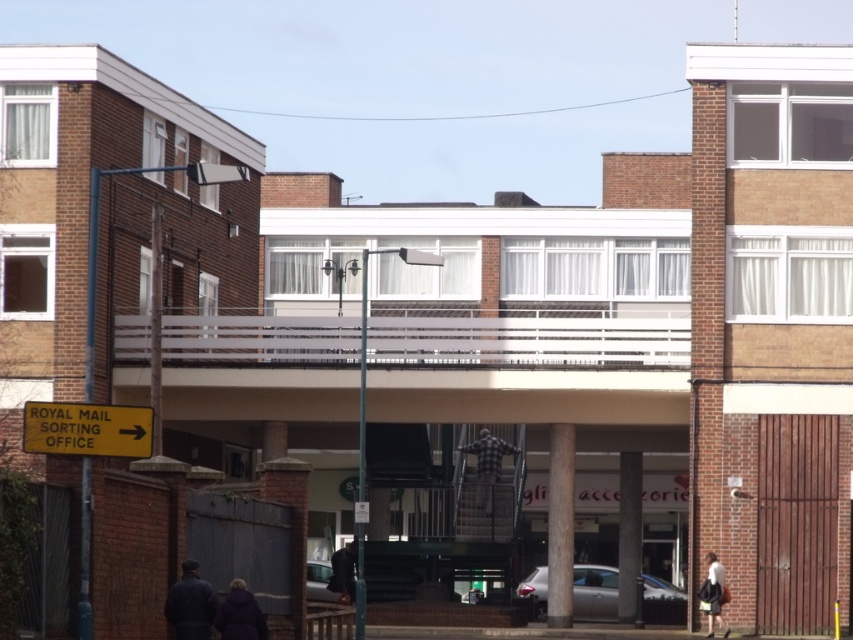
Question: In this image, where is yellow paper street sign at center located relative to checkered fabric shirt at center?

Choices:
 (A) below
 (B) above

Answer: (B)

Question: Which point is closer to the camera taking this photo?

Choices:
 (A) (172, 589)
 (B) (482, 486)

Answer: (A)

Question: Which object is the closest to the smooth concrete pillar at center?

Choices:
 (A) checkered fabric shirt at center
 (B) dark blue jacket at lower left
 (C) dark brown leather jacket at center

Answer: (A)

Question: Is dark gray concrete pillar at center bigger than purple fuzzy coat at lower center?

Choices:
 (A) no
 (B) yes

Answer: (A)

Question: Considering the relative positions of yellow paper street sign at center and dark brown leather jacket at center in the image provided, where is yellow paper street sign at center located with respect to dark brown leather jacket at center?

Choices:
 (A) right
 (B) left

Answer: (B)

Question: Among these points, which one is farthest from the camera?

Choices:
 (A) (714, 593)
 (B) (334, 589)
 (C) (102, 429)
 (D) (547, 612)

Answer: (D)